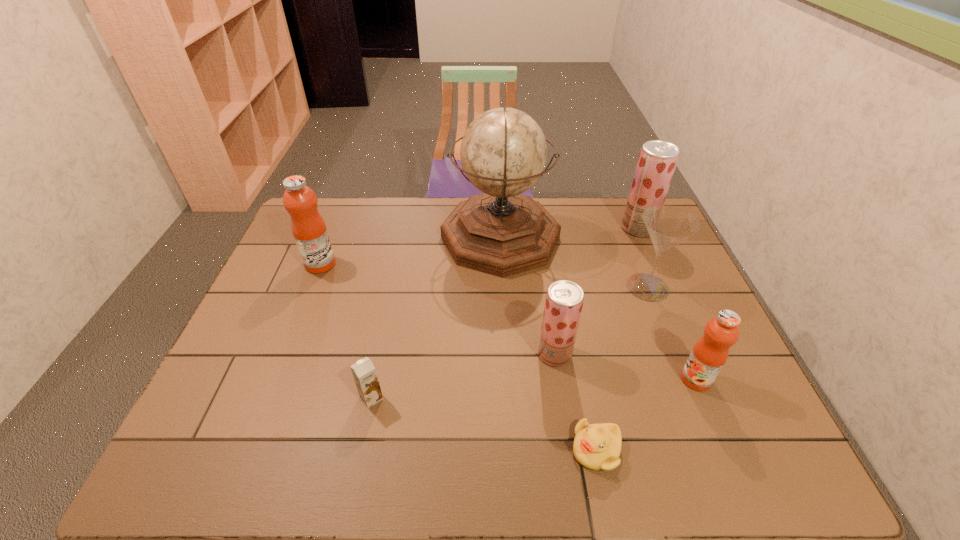
You are a GUI agent. You are given a task and a screenshot of the screen. Output one action in this format:
    pyautogui.click(x=<x>, y=<y>)
    Task: Click on the vacant region between the bigger orange fruit juice and the smaller strawberry fruit juice
    
    Given the screenshot: What is the action you would take?
    pyautogui.click(x=438, y=309)

Find the location of a particular element. This screenshot has width=960, height=540. vacant space that is in between the farther strawberry fruit juice and the tallest object is located at coordinates (569, 233).

The height and width of the screenshot is (540, 960). Identify the location of empty space between the tallest object and the flute glass. (574, 262).

In order to click on free space between the left orange fruit juice and the smaller orange fruit juice in this screenshot , I will do [x=508, y=322].

This screenshot has width=960, height=540. What are the coordinates of `unoccupied area between the chocolate milk and the right strawberry fruit juice` in the screenshot? It's located at (505, 313).

Where is `free area in between the chocolate milk and the globe`? Image resolution: width=960 pixels, height=540 pixels. free area in between the chocolate milk and the globe is located at coordinates [x=436, y=318].

Identify the location of free space between the right orange fruit juice and the flute glass. (672, 333).

Find the location of a particular element. The height and width of the screenshot is (540, 960). vacant area that lies between the seventh tallest object and the right orange fruit juice is located at coordinates click(534, 388).

I want to click on free space between the bigger strawberry fruit juice and the smaller strawberry fruit juice, so click(596, 291).

I want to click on object that is the sixth closest to the farther strawberry fruit juice, so click(x=364, y=373).